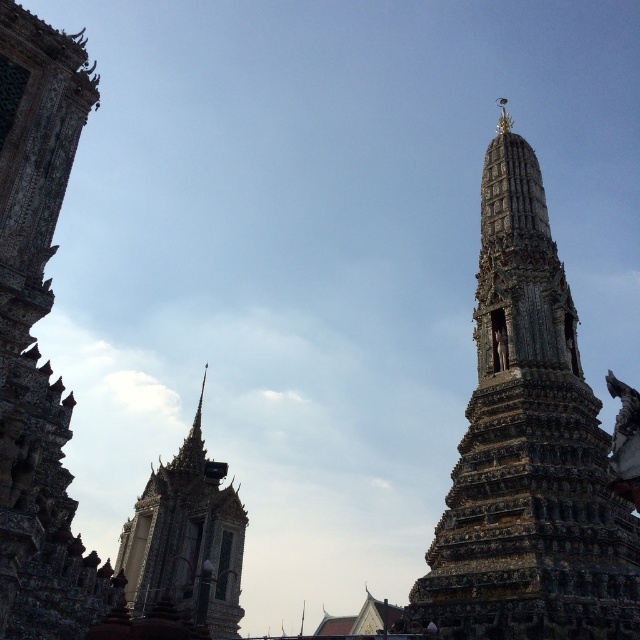
You are an architect analyzing the temple complex. You need to determine which structure has a smaller width between the carved stone stupa at right and the shiny gold spire at upper left. Which one is narrower?

The carved stone stupa at right is thinner than the shiny gold spire at upper left, so the carved stone stupa at right is narrower.

In the scene shown: Based on the coordinates provided, which object corresponds to the point at (529, 449) in the image?

The carved stone stupa at right corresponds to the point at (529, 449).

You are an architect assessing the temple complex. You need to determine which structure is taller between the carved stone stupa at right and the shiny gold spire at upper left. Based on the scene, which one is taller?

The carved stone stupa at right is taller than the shiny gold spire at upper left according to the description.